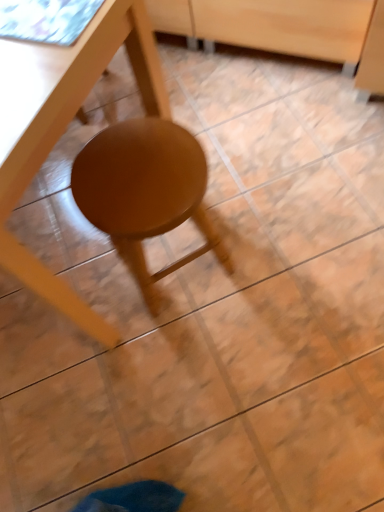
Question: Would you say matte wood stool at center contains matte wood table at center?

Choices:
 (A) no
 (B) yes

Answer: (A)

Question: From the image's perspective, is matte wood stool at center beneath matte wood table at center?

Choices:
 (A) yes
 (B) no

Answer: (A)

Question: From a real-world perspective, does matte wood stool at center stand above matte wood table at center?

Choices:
 (A) no
 (B) yes

Answer: (A)

Question: Is matte wood stool at center outside matte wood table at center?

Choices:
 (A) yes
 (B) no

Answer: (B)

Question: Is matte wood stool at center further to the viewer compared to matte wood table at center?

Choices:
 (A) yes
 (B) no

Answer: (A)

Question: Relative to matte wood stool at center, is wooden drawer at center in front or behind?

Choices:
 (A) front
 (B) behind

Answer: (B)

Question: From the image's perspective, is wooden drawer at center located above or below matte wood stool at center?

Choices:
 (A) below
 (B) above

Answer: (B)

Question: Considering the positions of wooden drawer at center and matte wood stool at center in the image, is wooden drawer at center taller or shorter than matte wood stool at center?

Choices:
 (A) tall
 (B) short

Answer: (B)

Question: Visually, is wooden drawer at center positioned to the left or to the right of matte wood stool at center?

Choices:
 (A) right
 (B) left

Answer: (A)

Question: Is matte wood stool at center in front of or behind wooden drawer at center in the image?

Choices:
 (A) front
 (B) behind

Answer: (A)

Question: Is matte wood stool at center to the left or to the right of wooden drawer at center in the image?

Choices:
 (A) left
 (B) right

Answer: (A)

Question: From the image's perspective, is matte wood stool at center positioned above or below wooden drawer at center?

Choices:
 (A) above
 (B) below

Answer: (B)

Question: From a real-world perspective, is matte wood stool at center physically located above or below wooden drawer at center?

Choices:
 (A) above
 (B) below

Answer: (A)

Question: Considering the positions of matte wood stool at center and matte wood table at center in the image, is matte wood stool at center wider or thinner than matte wood table at center?

Choices:
 (A) wide
 (B) thin

Answer: (B)

Question: From a real-world perspective, is matte wood stool at center above or below matte wood table at center?

Choices:
 (A) above
 (B) below

Answer: (B)